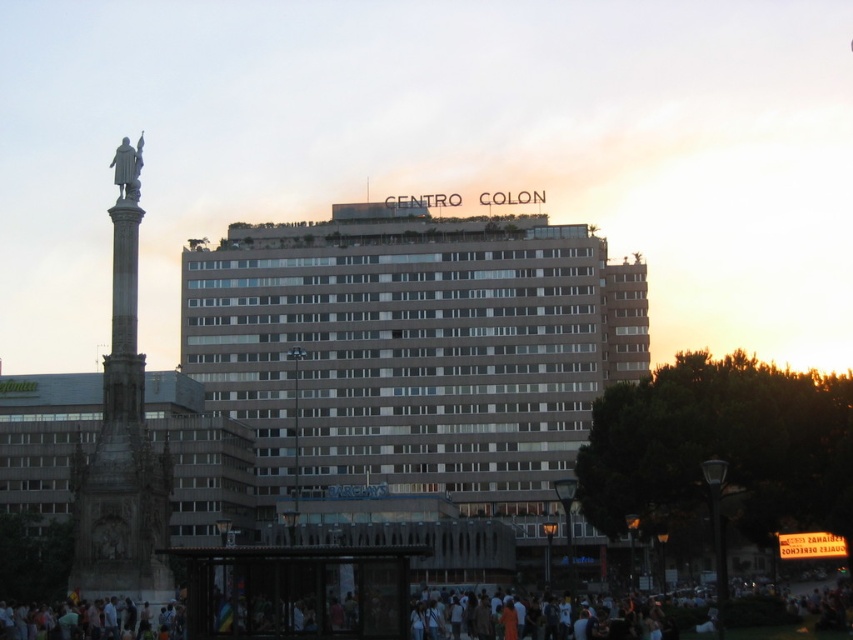
How distant is beige concrete building at center from white cotton crowd at lower center?

A distance of 24.97 meters exists between beige concrete building at center and white cotton crowd at lower center.

Which is more to the right, beige concrete building at center or white cotton crowd at lower center?

Positioned to the right is white cotton crowd at lower center.

The width and height of the screenshot is (853, 640). In order to click on beige concrete building at center in this screenshot , I will do `click(413, 352)`.

Locate an element on the screen. Image resolution: width=853 pixels, height=640 pixels. beige concrete building at center is located at coordinates (413, 352).

Between polished stone column at left and bronze statue at upper left, which one appears on the right side from the viewer's perspective?

From the viewer's perspective, bronze statue at upper left appears more on the right side.

Who is higher up, polished stone column at left or bronze statue at upper left?

Positioned higher is bronze statue at upper left.

You are a GUI agent. You are given a task and a screenshot of the screen. Output one action in this format:
    pyautogui.click(x=<x>, y=<y>)
    Task: Click on the polished stone column at left
    The height and width of the screenshot is (640, 853).
    Given the screenshot: What is the action you would take?
    pyautogui.click(x=122, y=456)

Consider the image. Does beige concrete building at center have a lesser height compared to polished stone column at left?

No, beige concrete building at center is not shorter than polished stone column at left.

Between point (334, 282) and point (167, 454), which one is positioned in front?

Point (167, 454)

Where is `beige concrete building at center`? The width and height of the screenshot is (853, 640). beige concrete building at center is located at coordinates (413, 352).